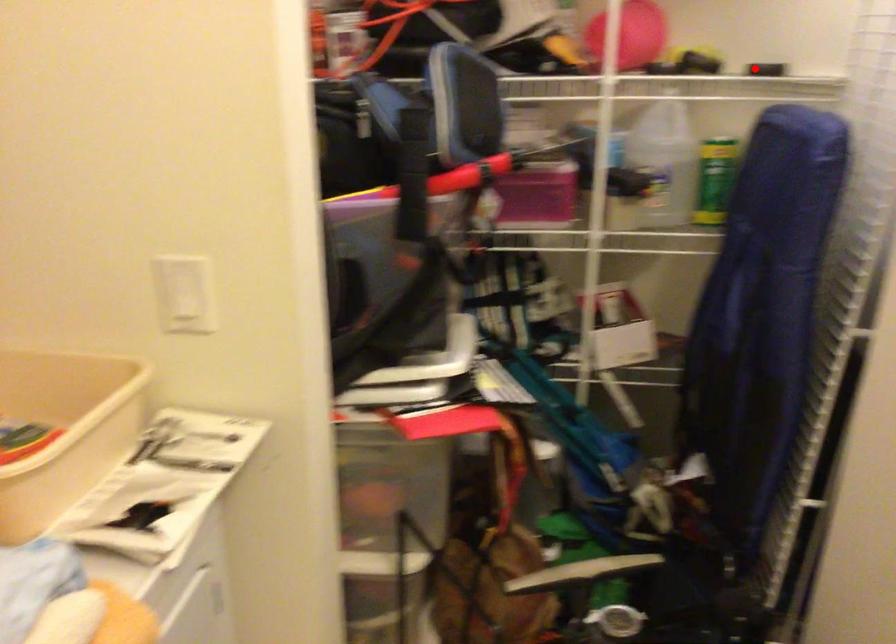
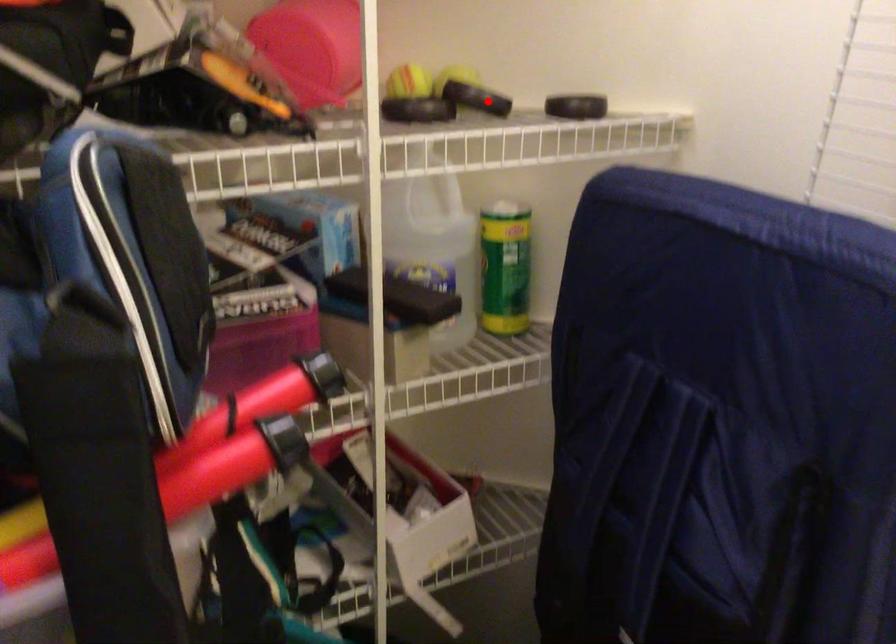
I am providing you with two images of the same scene from different viewpoints. A red point is marked on the first image and another point is marked on the second image. Are the points marked in image1 and image2 representing the same 3D position?

No